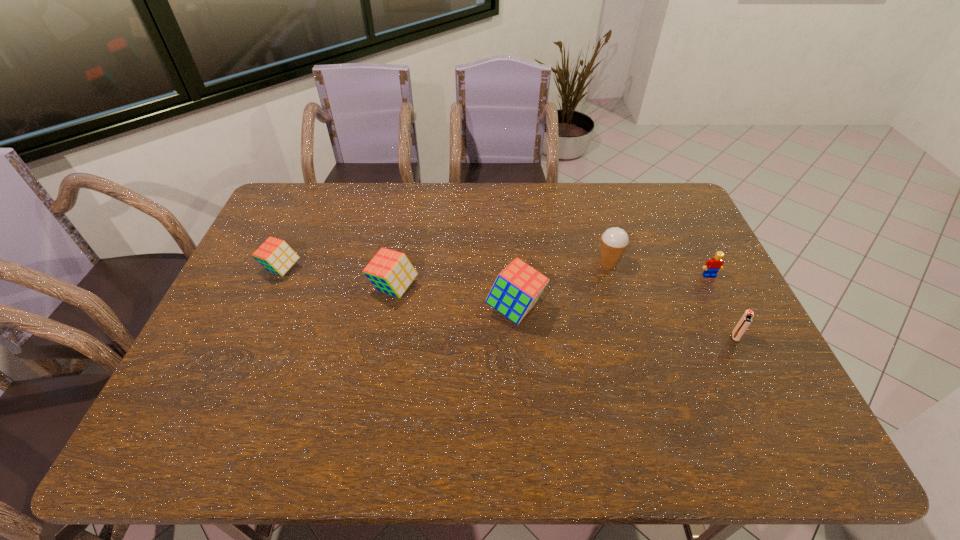
Identify the location of vacant space situated 0.170m on the front of the fourth object from right to left. (521, 387).

The image size is (960, 540). What are the coordinates of `blank area located on the front-facing side of the Lego` in the screenshot? It's located at (718, 293).

You are a GUI agent. You are given a task and a screenshot of the screen. Output one action in this format:
    pyautogui.click(x=<x>, y=<y>)
    Task: Click on the free space located 0.170m on the left of the nearest object
    
    Given the screenshot: What is the action you would take?
    pyautogui.click(x=667, y=336)

I want to click on vacant space located on the left of the fourth object from left to right, so click(x=573, y=264).

You are a GUI agent. You are given a task and a screenshot of the screen. Output one action in this format:
    pyautogui.click(x=<x>, y=<y>)
    Task: Click on the object that is positioned at the left edge
    This screenshot has width=960, height=540.
    Given the screenshot: What is the action you would take?
    pyautogui.click(x=274, y=254)

Where is `Lego at the right edge`? Image resolution: width=960 pixels, height=540 pixels. Lego at the right edge is located at coordinates (712, 266).

Identify the location of igniter that is at the right edge. (745, 321).

In the image, there is a desktop. At what (x,y) coordinates should I click in order to perform the action: click on vacant space at the far edge. Please return your answer as a coordinate pair (x, y). This screenshot has height=540, width=960. Looking at the image, I should click on (338, 197).

Locate an element on the screen. The height and width of the screenshot is (540, 960). vacant area at the left edge is located at coordinates (277, 231).

In the image, there is a desktop. Where is `free region at the right edge`? This screenshot has height=540, width=960. free region at the right edge is located at coordinates (687, 252).